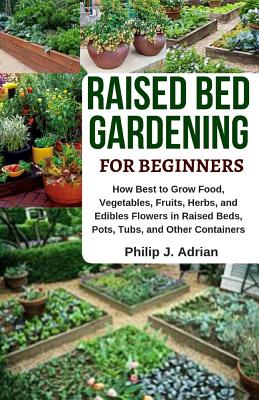
The height and width of the screenshot is (400, 259). I want to click on vase, so click(146, 50).